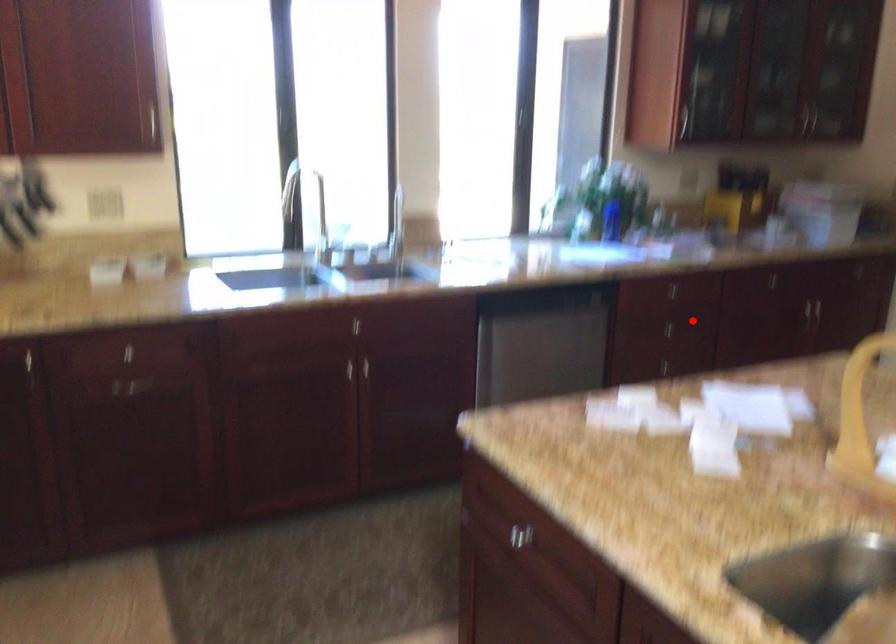
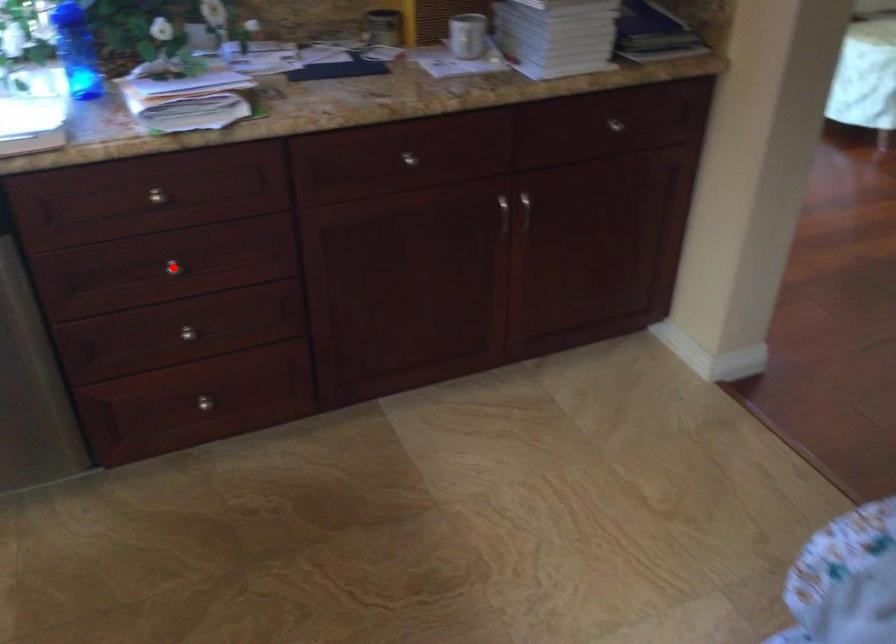
I am providing you with two images of the same scene from different viewpoints. A red point is marked on the first image and another point is marked on the second image. Does the point marked in image1 correspond to the same location as the one in image2?

Yes